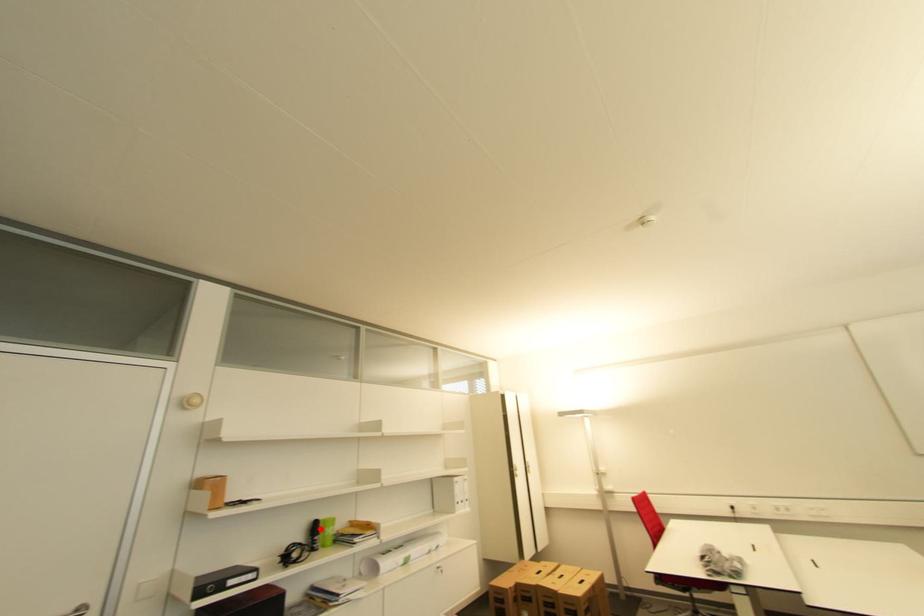
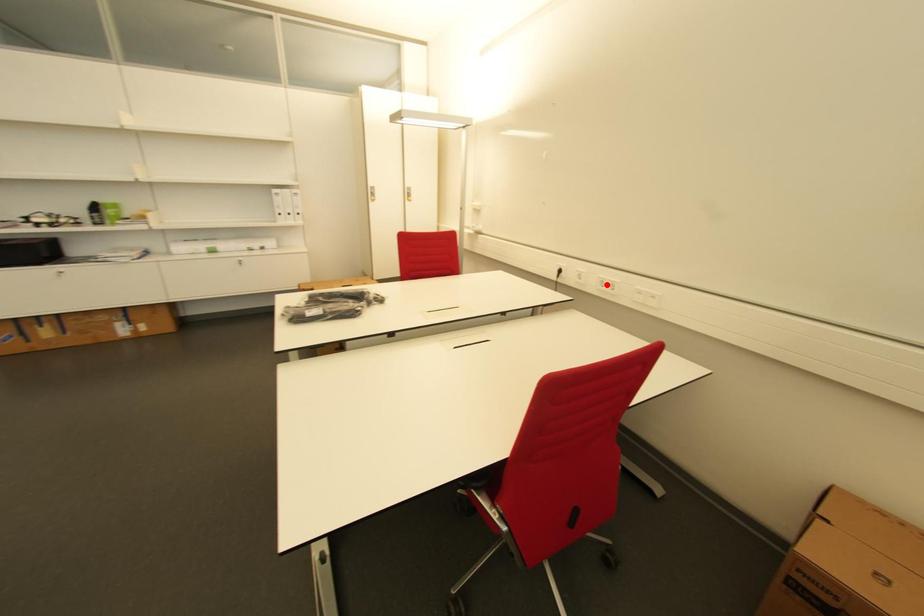
I am providing you with two images of the same scene from different viewpoints. A red point is marked on the first image and another point is marked on the second image. Is the marked point in image1 the same physical position as the marked point in image2?

No